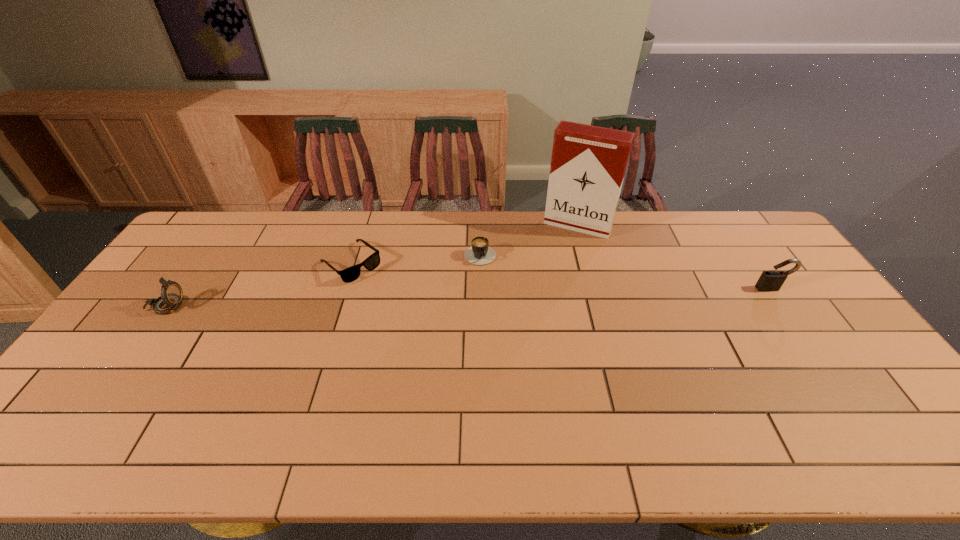
At what (x,y) coordinates should I click in order to perform the action: click on object identified as the second closest to the rightmost object. Please return your answer as a coordinate pair (x, y). This screenshot has height=540, width=960. Looking at the image, I should click on (480, 253).